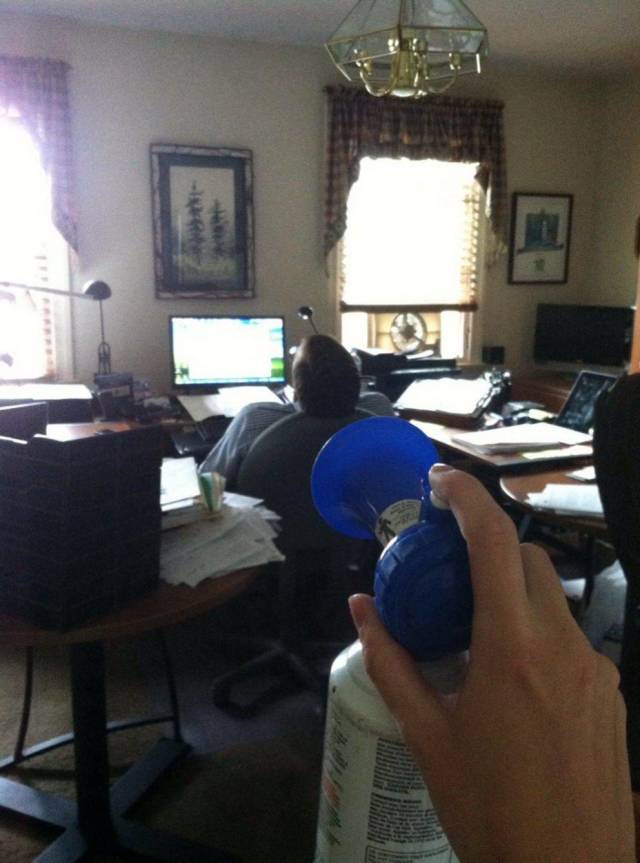
Where is `chandelier`? This screenshot has height=863, width=640. chandelier is located at coordinates (434, 38).